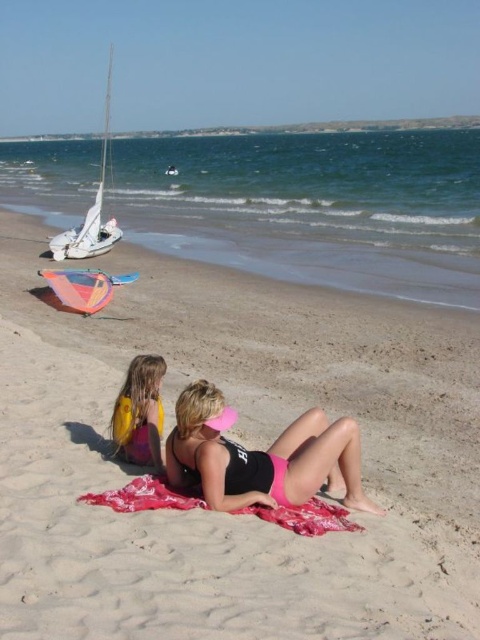
Based on the scene description, what object is located at the coordinates point (144, 497)?

The point (144, 497) marks the location of the red woven towel at center.

You are a beachgoer who wants to place your beach umbrella between the red woven towel at center and the yellow life vest at lower left. Based on their positions, which object should you place the umbrella closer to if you want it to be on the right side of both items?

The red woven towel at center is to the right of the yellow life vest at lower left. To place the umbrella on the right side of both items, position it closer to the red woven towel at center.

Consider the image. You are planning to set up a beach umbrella. You have two options for placement based on the objects in the scene. The first option is to place it near the red woven towel at center, and the second is near the white sailboat at left. Which location would allow the umbrella to be farther from the ocean?

The white sailboat at left is farther from the ocean than the red woven towel at center. Therefore, placing the umbrella near the white sailboat at left would be farther from the ocean.